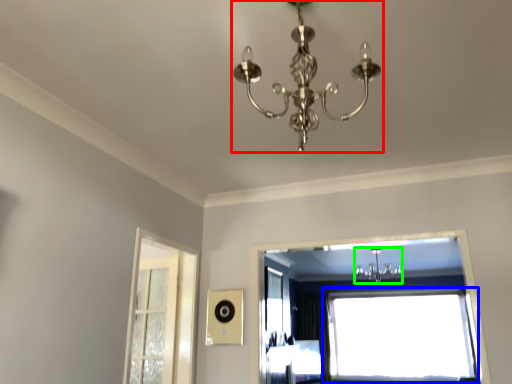
Question: Which object is positioned closest to lamp (highlighted by a red box)? Select from window (highlighted by a blue box) and light fixture (highlighted by a green box).

Choices:
 (A) window
 (B) light fixture

Answer: (B)